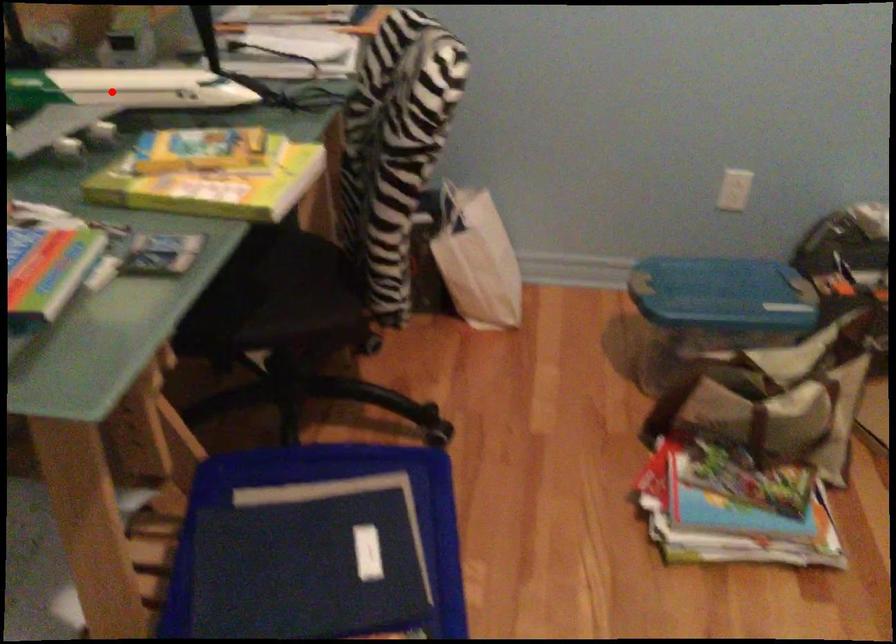
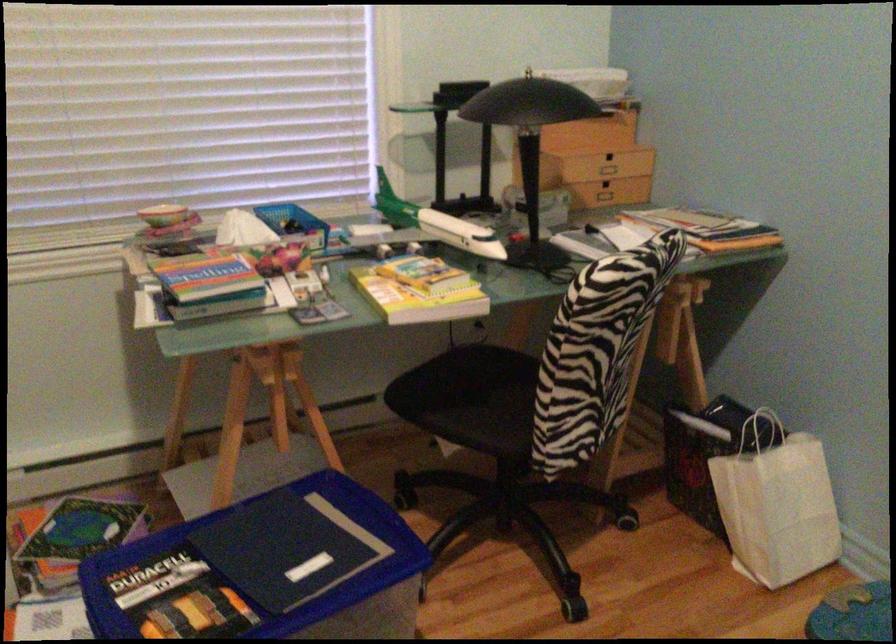
The point at the highlighted location is marked in the first image. Where is the corresponding point in the second image?

(438, 225)